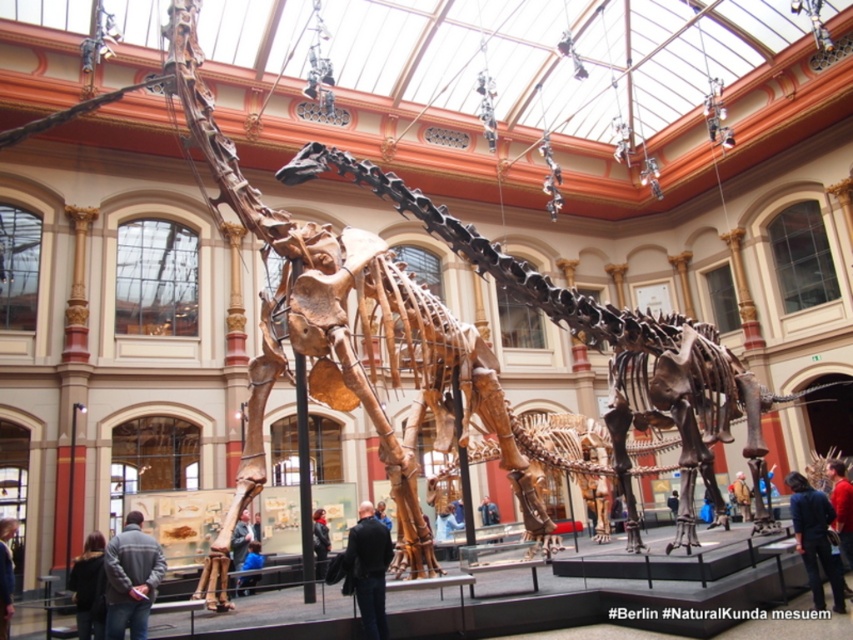
Is point (793, 486) positioned behind point (236, 525)?

No, it is in front of (236, 525).

How distant is dark blue fabric jacket at lower right from blue jeans at center?

29.50 meters

Does point (805, 536) come behind point (242, 538)?

No, (805, 536) is in front of (242, 538).

Where is `dark blue fabric jacket at lower right`? The width and height of the screenshot is (853, 640). dark blue fabric jacket at lower right is located at coordinates (815, 540).

Who is positioned more to the right, brown bone-like skeleton at center or dark blue jeans at center?

brown bone-like skeleton at center is more to the right.

Is brown bone-like skeleton at center bigger than dark blue jeans at center?

Yes, brown bone-like skeleton at center is bigger than dark blue jeans at center.

Describe the element at coordinates (605, 346) in the screenshot. I see `brown bone-like skeleton at center` at that location.

Where is `brown bone-like skeleton at center`? This screenshot has height=640, width=853. brown bone-like skeleton at center is located at coordinates (605, 346).

Between dark blue jeans at center and blue fabric jacket at center, which one appears on the left side from the viewer's perspective?

From the viewer's perspective, blue fabric jacket at center appears more on the left side.

At what (x,y) coordinates should I click in order to perform the action: click on dark blue jeans at center. Please return your answer as a coordinate pair (x, y). The height and width of the screenshot is (640, 853). Looking at the image, I should click on (368, 570).

This screenshot has width=853, height=640. In order to click on dark blue jeans at center in this screenshot , I will do `click(368, 570)`.